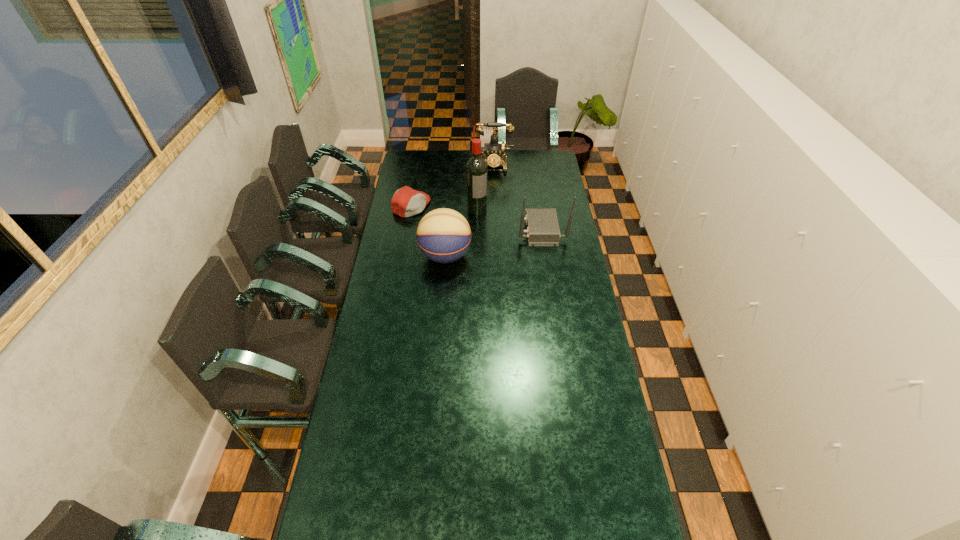
The height and width of the screenshot is (540, 960). Find the location of `empty space that is in between the tallest object and the router`. empty space that is in between the tallest object and the router is located at coordinates (509, 220).

Locate an element on the screen. Image resolution: width=960 pixels, height=540 pixels. empty location between the tallest object and the router is located at coordinates (509, 220).

The height and width of the screenshot is (540, 960). Find the location of `object that is the fourth closest to the cap`. object that is the fourth closest to the cap is located at coordinates (542, 225).

Where is `object that stands as the fourth closest to the cap`? This screenshot has width=960, height=540. object that stands as the fourth closest to the cap is located at coordinates (542, 225).

Where is `vacant area in the image that satisfies the following two spatial constraints: 1. on the back side of the farthest object; 2. on the left side of the tallest object`? Image resolution: width=960 pixels, height=540 pixels. vacant area in the image that satisfies the following two spatial constraints: 1. on the back side of the farthest object; 2. on the left side of the tallest object is located at coordinates (477, 165).

You are a GUI agent. You are given a task and a screenshot of the screen. Output one action in this format:
    pyautogui.click(x=<x>, y=<y>)
    Task: Click on the free space in the image that satisfies the following two spatial constraints: 1. on the front side of the shortest object; 2. on the patterned surface of the basketball
    The image size is (960, 540).
    Given the screenshot: What is the action you would take?
    pyautogui.click(x=402, y=256)